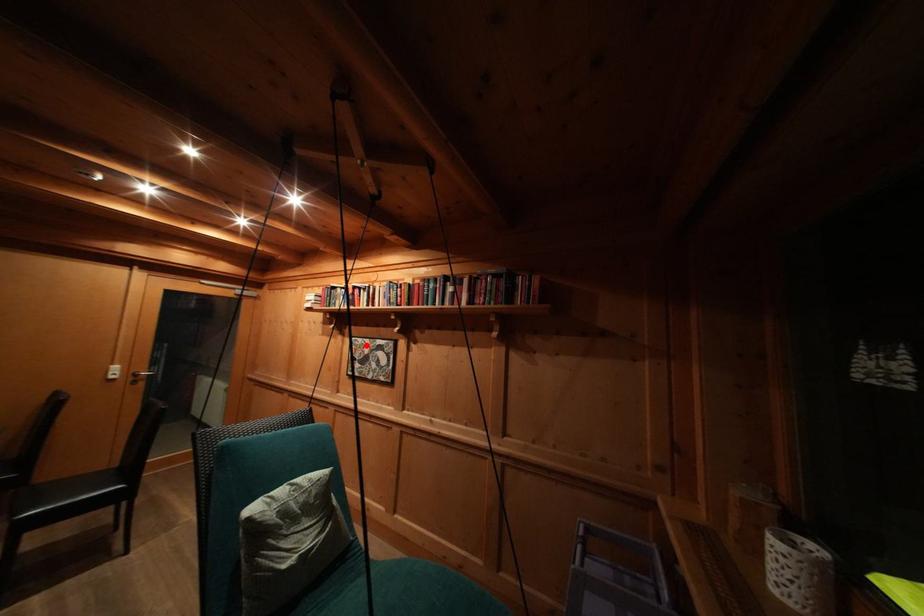
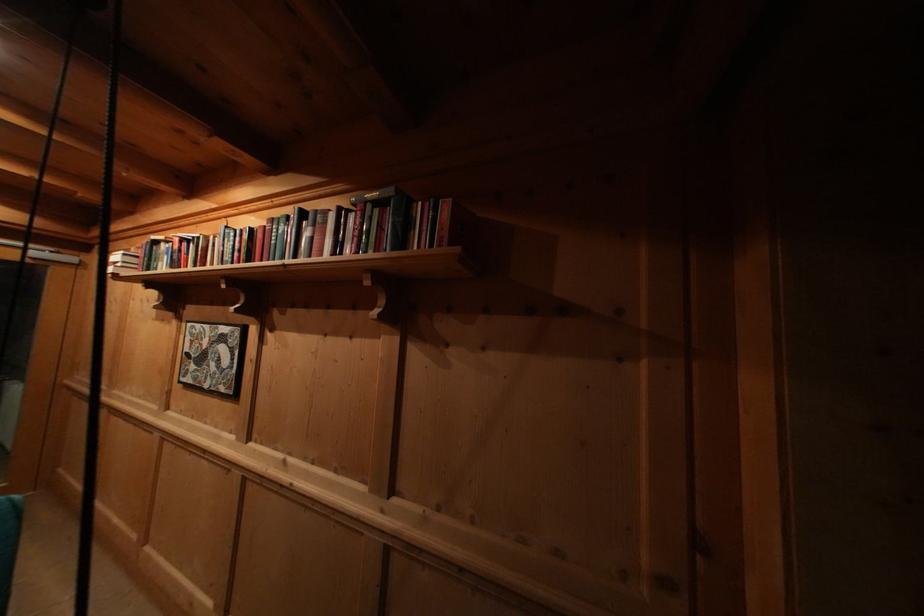
Find the pixel in the second image that matches the highlighted location in the first image.

(204, 331)